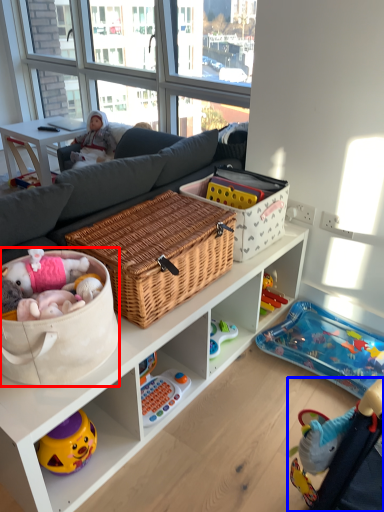
Question: Among these objects, which one is nearest to the camera, storage box (highlighted by a red box) or baby carriage (highlighted by a blue box)?

Choices:
 (A) storage box
 (B) baby carriage

Answer: (B)